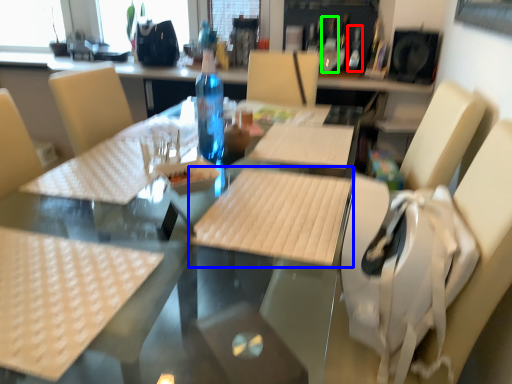
Question: Considering the real-world distances, which object is closest to bottle (highlighted by a red box)? plywood (highlighted by a blue box) or wine bottle (highlighted by a green box).

Choices:
 (A) plywood
 (B) wine bottle

Answer: (B)